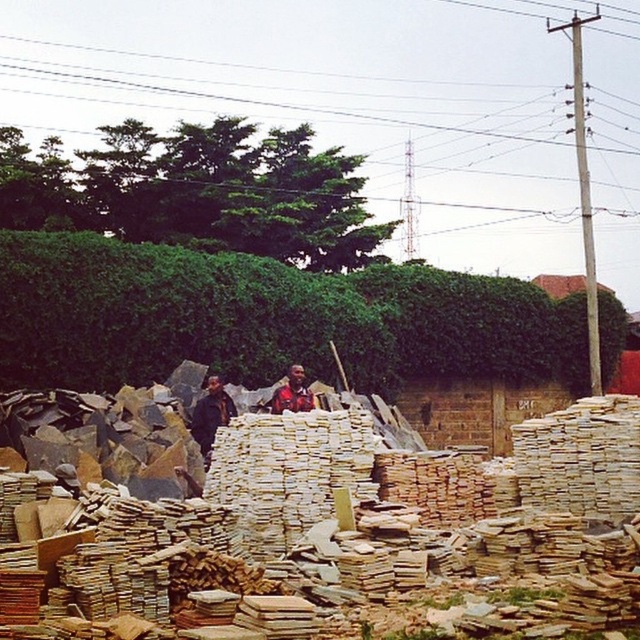
Describe the element at coordinates (330, 534) in the screenshot. I see `natural stone blocks at center` at that location.

Is natural stone blocks at center further to the viewer compared to matte brown shirt at center?

No, it is not.

Which is behind, point (262, 468) or point (300, 365)?

The point (300, 365) is behind.

The height and width of the screenshot is (640, 640). Find the location of `natural stone blocks at center`. natural stone blocks at center is located at coordinates (330, 534).

Does natural stone blocks at center have a greater height compared to green leafy hedge at center?

Incorrect, natural stone blocks at center's height is not larger of green leafy hedge at center's.

This screenshot has width=640, height=640. What do you see at coordinates (330, 534) in the screenshot?
I see `natural stone blocks at center` at bounding box center [330, 534].

You are a GUI agent. You are given a task and a screenshot of the screen. Output one action in this format:
    pyautogui.click(x=<x>, y=<y>)
    Task: Click on the natural stone blocks at center
    
    Given the screenshot: What is the action you would take?
    pyautogui.click(x=330, y=534)

Can you confirm if natural stone blocks at center is bigger than dark brown leather jacket at center?

Indeed, natural stone blocks at center has a larger size compared to dark brown leather jacket at center.

Is natural stone blocks at center to the right of dark brown leather jacket at center from the viewer's perspective?

Indeed, natural stone blocks at center is positioned on the right side of dark brown leather jacket at center.

The width and height of the screenshot is (640, 640). Find the location of `natural stone blocks at center`. natural stone blocks at center is located at coordinates (330, 534).

At what (x,y) coordinates should I click in order to perform the action: click on natural stone blocks at center. Please return your answer as a coordinate pair (x, y). The image size is (640, 640). Looking at the image, I should click on (330, 534).